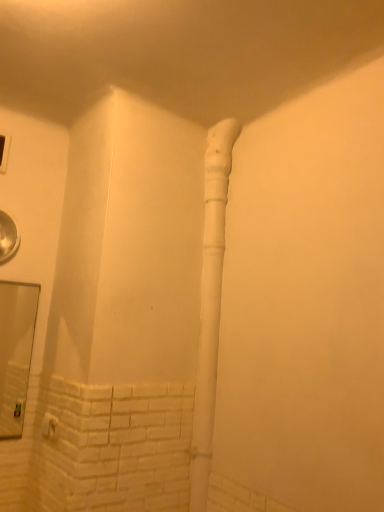
What do you see at coordinates (210, 304) in the screenshot? The width and height of the screenshot is (384, 512). I see `white matte water pipe at center` at bounding box center [210, 304].

This screenshot has width=384, height=512. Identify the location of white matte water pipe at center. (210, 304).

In order to face white matte water pipe at center, should I rotate leftwards or rightwards?

You should look right and rotate roughly 2.972 degrees.

Measure the distance between point (1,315) and camera.

Point (1,315) is 2.46 meters away from camera.

What is the approximate height of clear glass mirror at lower left?

It is 24.31 inches.

At what (x,y) coordinates should I click in order to perform the action: click on clear glass mirror at lower left. Please return your answer as a coordinate pair (x, y). The image size is (384, 512). Looking at the image, I should click on (15, 352).

What do you see at coordinates (15, 352) in the screenshot? This screenshot has height=512, width=384. I see `clear glass mirror at lower left` at bounding box center [15, 352].

Locate an element on the screen. The image size is (384, 512). white matte water pipe at center is located at coordinates (210, 304).

From the picture: In the image, is clear glass mirror at lower left on the left side or the right side of white matte water pipe at center?

Clearly, clear glass mirror at lower left is on the left of white matte water pipe at center in the image.

Which is in front, clear glass mirror at lower left or white matte water pipe at center?

white matte water pipe at center is more forward.

Is point (10, 305) positioned after point (197, 472)?

Yes.

From the image's perspective, would you say clear glass mirror at lower left is shown under white matte water pipe at center?

Yes.

From a real-world perspective, is clear glass mirror at lower left physically above white matte water pipe at center?

Actually, clear glass mirror at lower left is physically below white matte water pipe at center in the real world.

Can you confirm if clear glass mirror at lower left is wider than white matte water pipe at center?

In fact, clear glass mirror at lower left might be narrower than white matte water pipe at center.

Who is taller, clear glass mirror at lower left or white matte water pipe at center?

Standing taller between the two is white matte water pipe at center.

Considering the sizes of objects clear glass mirror at lower left and white matte water pipe at center in the image provided, who is bigger, clear glass mirror at lower left or white matte water pipe at center?

white matte water pipe at center.

Is clear glass mirror at lower left outside of white matte water pipe at center?

Indeed, clear glass mirror at lower left is completely outside white matte water pipe at center.

Can you see clear glass mirror at lower left touching white matte water pipe at center?

No, clear glass mirror at lower left is not with white matte water pipe at center.

Could you tell me if clear glass mirror at lower left is turned towards white matte water pipe at center?

No, clear glass mirror at lower left is not aimed at white matte water pipe at center.

How different are the orientations of clear glass mirror at lower left and white matte water pipe at center in degrees?

The angular difference between clear glass mirror at lower left and white matte water pipe at center is 92.5 degrees.

The image size is (384, 512). What are the coordinates of `water pipe that appears in front of the clear glass mirror at lower left` in the screenshot? It's located at (210, 304).

Which object is positioned more to the right, white matte water pipe at center or clear glass mirror at lower left?

Positioned to the right is white matte water pipe at center.

Is the position of white matte water pipe at center more distant than that of clear glass mirror at lower left?

No, white matte water pipe at center is in front of clear glass mirror at lower left.

Considering the positions of points (214, 297) and (23, 392), is point (214, 297) farther from camera compared to point (23, 392)?

No.

From the image's perspective, would you say white matte water pipe at center is shown under clear glass mirror at lower left?

No.

From a real-world perspective, which object rests below the other?

clear glass mirror at lower left, from a real-world perspective.

Does white matte water pipe at center have a lesser width compared to clear glass mirror at lower left?

No.

Considering the sizes of white matte water pipe at center and clear glass mirror at lower left in the image, is white matte water pipe at center taller or shorter than clear glass mirror at lower left?

Considering their sizes, white matte water pipe at center has more height than clear glass mirror at lower left.

Considering the relative sizes of white matte water pipe at center and clear glass mirror at lower left in the image provided, is white matte water pipe at center smaller than clear glass mirror at lower left?

Incorrect, white matte water pipe at center is not smaller in size than clear glass mirror at lower left.

Choose the correct answer: Is white matte water pipe at center inside clear glass mirror at lower left or outside it?

white matte water pipe at center cannot be found inside clear glass mirror at lower left.

Is white matte water pipe at center not near clear glass mirror at lower left?

Yes, white matte water pipe at center and clear glass mirror at lower left are quite far apart.

Is white matte water pipe at center facing away from clear glass mirror at lower left?

No, white matte water pipe at center is not facing the opposite direction of clear glass mirror at lower left.

How different are the orientations of white matte water pipe at center and clear glass mirror at lower left in degrees?

They differ by 92.5 degrees in their facing directions.

Locate an element on the screen. mirror located below the white matte water pipe at center (from the image's perspective) is located at coordinates (15, 352).

The width and height of the screenshot is (384, 512). I want to click on mirror below the white matte water pipe at center (from the image's perspective), so click(15, 352).

Locate an element on the screen. This screenshot has height=512, width=384. mirror on the left of the white matte water pipe at center is located at coordinates (15, 352).